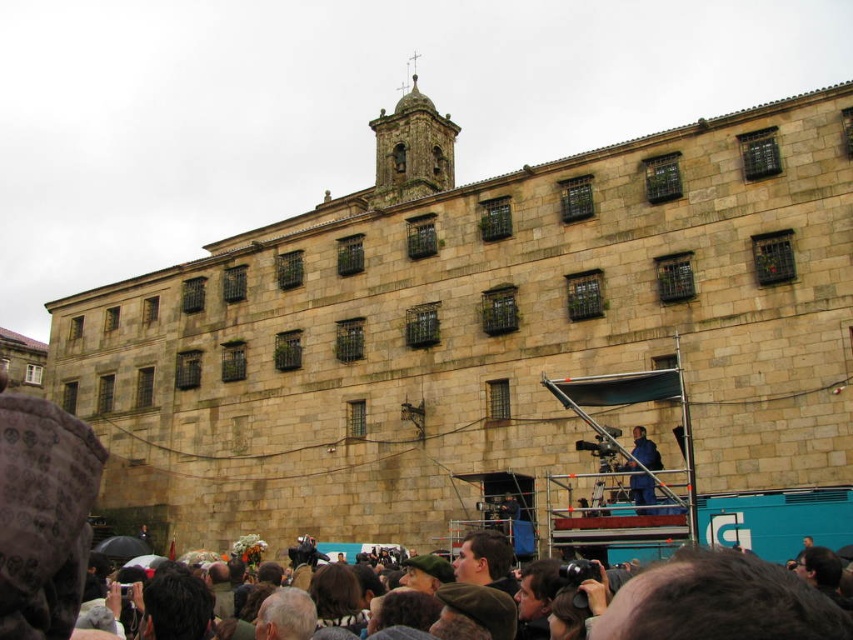
Question: Among these points, which one is farthest from the camera?

Choices:
 (A) (654, 605)
 (B) (654, 461)

Answer: (B)

Question: Which point appears closest to the camera in this image?

Choices:
 (A) (444, 125)
 (B) (636, 445)
 (C) (740, 636)

Answer: (C)

Question: From the image, what is the correct spatial relationship of dark brown stone tower at upper center in relation to blue fabric at center?

Choices:
 (A) below
 (B) above

Answer: (B)

Question: Which object appears closest to the camera in this image?

Choices:
 (A) dark brown hair at lower center
 (B) dark brown stone tower at upper center

Answer: (A)

Question: Does dark brown hair at lower center have a lesser width compared to dark brown stone tower at upper center?

Choices:
 (A) yes
 (B) no

Answer: (A)

Question: Does dark brown stone tower at upper center have a greater width compared to blue fabric at center?

Choices:
 (A) yes
 (B) no

Answer: (A)